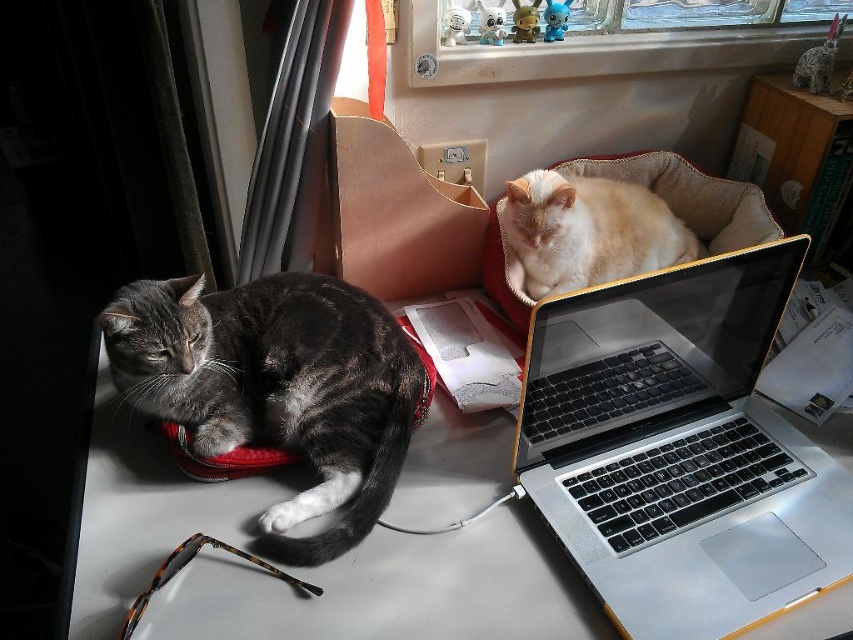
Based on the photo, what object is located at the coordinates point (679, 449)?

The point (679, 449) is on the silver metallic laptop at center.

You are organizing a small toy for the cats and need to place it on the largest surface available. Which object between the white glossy table at lower left and the gray fur cat at left should you choose?

The white glossy table at lower left is bigger than the gray fur cat at left, so you should place the toy on the white glossy table at lower left.

You are organizing a small toy for the cats and need to place it on the lowest surface available. Which object between the white glossy table at lower left and the gray fur cat at left should you choose?

The white glossy table at lower left has a lesser height compared to the gray fur cat at left, so you should place the toy on the white glossy table at lower left as it is the lower surface.